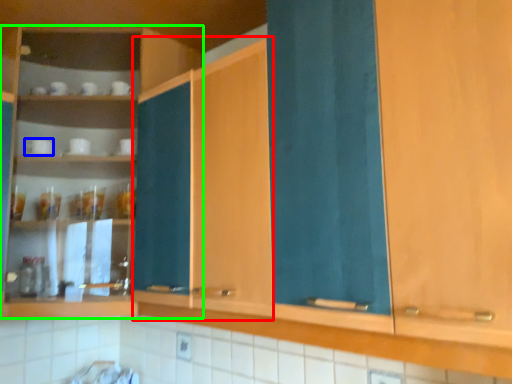
Question: Which is farther away from cabinetry (highlighted by a red box)? tableware (highlighted by a blue box) or cabinetry (highlighted by a green box)?

Choices:
 (A) tableware
 (B) cabinetry

Answer: (A)